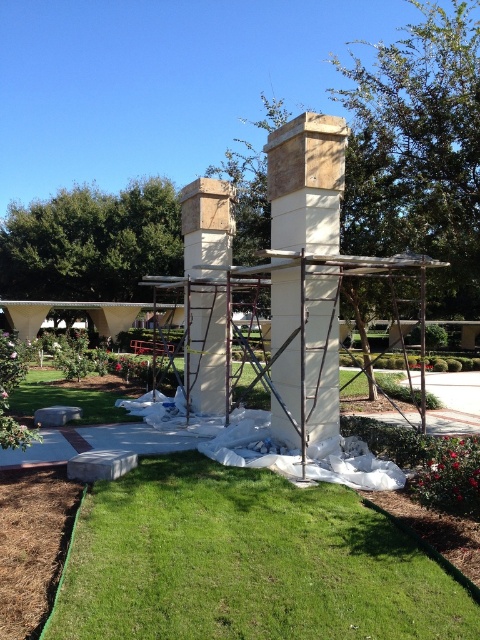
Is green grass at lower center positioned behind beige stone chimney at center?

No, it is not.

This screenshot has width=480, height=640. I want to click on green grass at lower center, so click(x=247, y=563).

Who is lower down, beige stone gazebo at center or beige stone chimney at center?

beige stone chimney at center is below.

Does beige stone gazebo at center have a larger size compared to beige stone chimney at center?

No, beige stone gazebo at center is not bigger than beige stone chimney at center.

Who is more forward, (x=333, y=145) or (x=300, y=168)?

Point (x=300, y=168)

Locate an element on the screen. The image size is (480, 640). beige stone gazebo at center is located at coordinates (308, 275).

Is green grass at lower center to the right of beige stone gazebo at center from the viewer's perspective?

Correct, you'll find green grass at lower center to the right of beige stone gazebo at center.

Who is shorter, green grass at lower center or beige stone gazebo at center?

green grass at lower center is shorter.

Is point (183, 568) less distant than point (279, 390)?

Yes, it is.

At what (x,y) coordinates should I click in order to perform the action: click on green grass at lower center. Please return your answer as a coordinate pair (x, y). The width and height of the screenshot is (480, 640). Looking at the image, I should click on (247, 563).